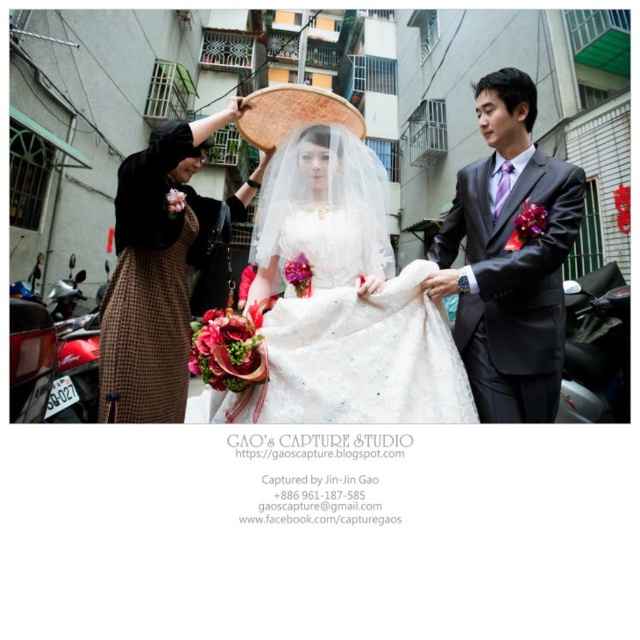
Question: Is shiny black suit at right wider than brown checkered dress at left?

Choices:
 (A) yes
 (B) no

Answer: (B)

Question: Can you confirm if white satin dress at center is positioned above brown checkered dress at left?

Choices:
 (A) yes
 (B) no

Answer: (A)

Question: Is white lace dress at center closer to the viewer compared to brown checkered dress at left?

Choices:
 (A) no
 (B) yes

Answer: (B)

Question: Among these objects, which one is nearest to the camera?

Choices:
 (A) shiny black suit at right
 (B) brown checkered dress at left
 (C) white satin dress at center

Answer: (A)

Question: Which point is closer to the camera?

Choices:
 (A) (436, 326)
 (B) (156, 284)

Answer: (A)

Question: Which point is farther to the camera?

Choices:
 (A) (536, 154)
 (B) (344, 160)
 (C) (179, 314)
 (D) (173, 147)

Answer: (C)